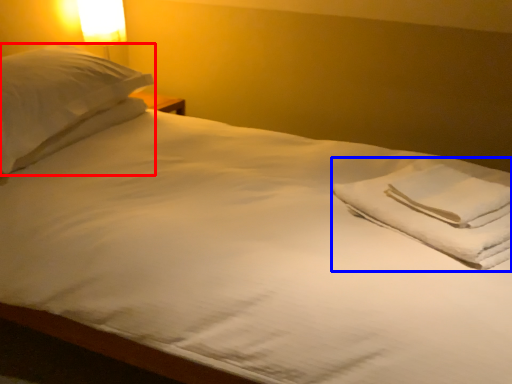
Question: Which object appears closest to the camera in this image, pillow (highlighted by a red box) or material (highlighted by a blue box)?

Choices:
 (A) pillow
 (B) material

Answer: (B)